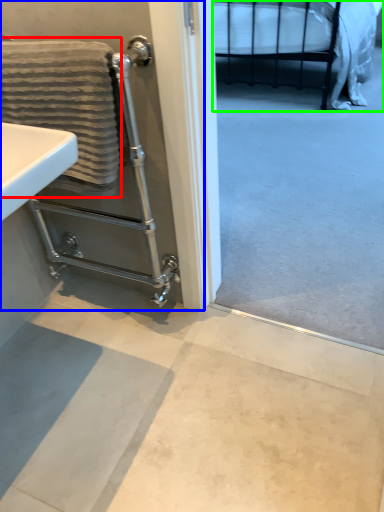
Question: Which object is the farthest from bath towel (highlighted by a red box)? Choose among these: screen door (highlighted by a blue box) or bed (highlighted by a green box).

Choices:
 (A) screen door
 (B) bed

Answer: (B)